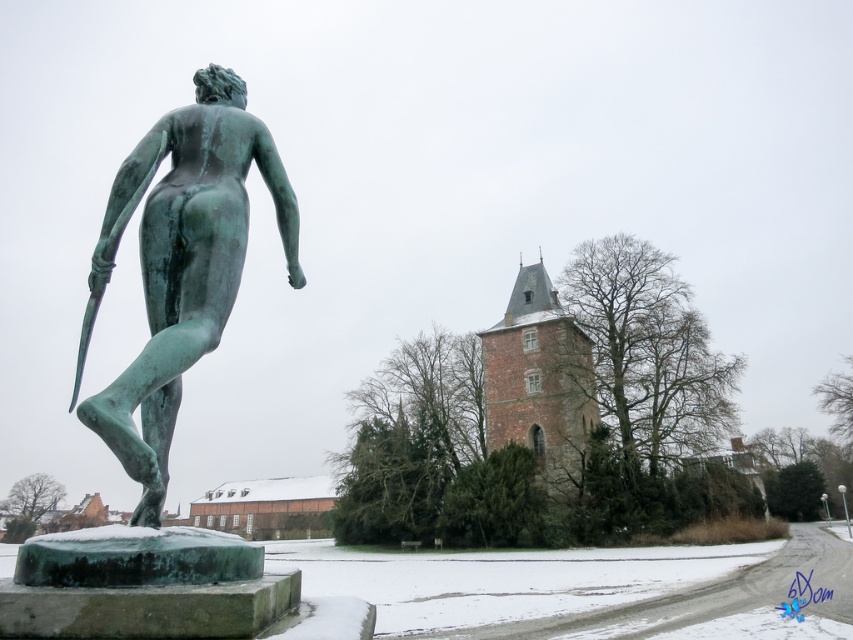
Question: Can you confirm if green patina bronze statue at left is positioned below brown wooden church at center?

Choices:
 (A) yes
 (B) no

Answer: (B)

Question: Is green patina bronze statue at left behind brown wooden church at center?

Choices:
 (A) yes
 (B) no

Answer: (B)

Question: Does green patina bronze statue at left appear on the right side of brown wooden church at center?

Choices:
 (A) no
 (B) yes

Answer: (A)

Question: Which point is farther to the camera?

Choices:
 (A) brown wooden church at center
 (B) green patina bronze statue at left

Answer: (A)

Question: Which object is closer to the camera taking this photo?

Choices:
 (A) brown wooden church at center
 (B) green patina bronze statue at left

Answer: (B)